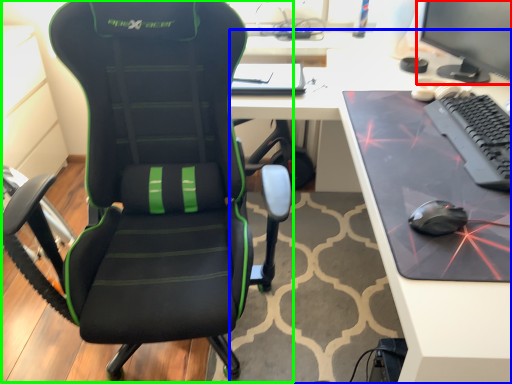
Question: Considering the real-world distances, which object is farthest from computer monitor (highlighted by a red box)? desk (highlighted by a blue box) or chair (highlighted by a green box)?

Choices:
 (A) desk
 (B) chair

Answer: (B)